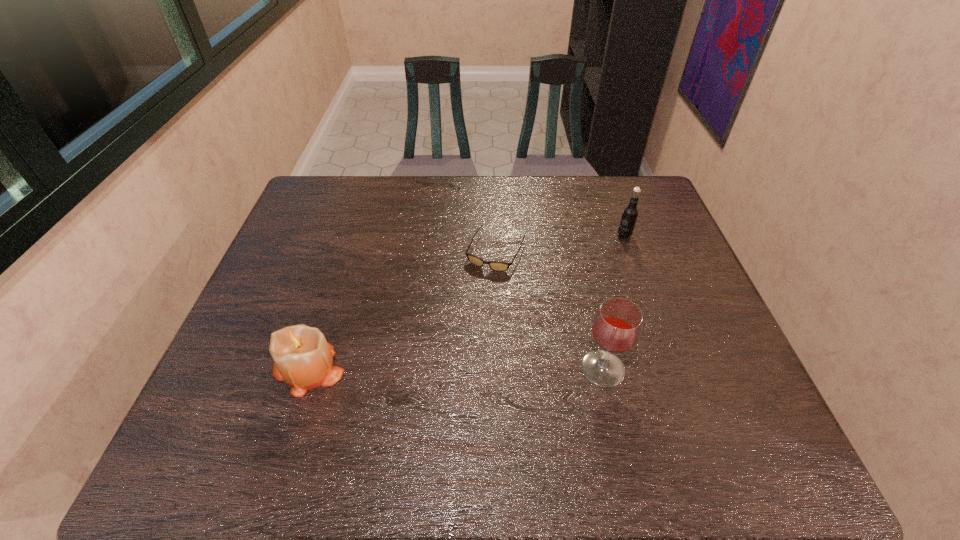
Find the location of a particular element. vacant space at the left edge of the desktop is located at coordinates (300, 247).

Image resolution: width=960 pixels, height=540 pixels. I want to click on vacant space at the right edge of the desktop, so click(x=673, y=302).

At what (x,y) coordinates should I click in order to perform the action: click on vacant space at the far right corner of the desktop. Please return your answer as a coordinate pair (x, y). This screenshot has height=540, width=960. Looking at the image, I should click on (626, 175).

Where is `free spot between the second object from left to right and the third object from left to right`? The image size is (960, 540). free spot between the second object from left to right and the third object from left to right is located at coordinates (x=549, y=310).

Find the location of a particular element. The image size is (960, 540). empty space that is in between the sunglasses and the second object from right to left is located at coordinates (549, 310).

Where is `free space between the root beer and the candle`? The width and height of the screenshot is (960, 540). free space between the root beer and the candle is located at coordinates click(467, 302).

The image size is (960, 540). Identify the location of free space between the leftmost object and the third object from left to right. (455, 369).

Where is `unoccupied position between the second object from right to left and the leftmost object`? Image resolution: width=960 pixels, height=540 pixels. unoccupied position between the second object from right to left and the leftmost object is located at coordinates (455, 369).

The image size is (960, 540). Find the location of `free spot between the second object from right to left and the second object from left to right`. free spot between the second object from right to left and the second object from left to right is located at coordinates (549, 310).

The image size is (960, 540). I want to click on vacant area between the sunglasses and the candle, so click(x=402, y=310).